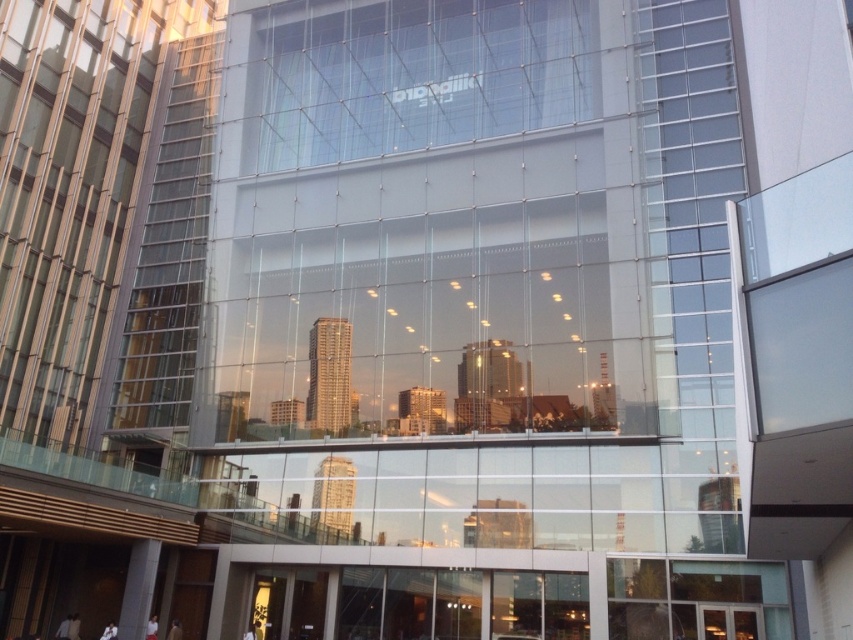
Is point (138, 141) less distant than point (296, 161)?

No.

Is transparent glass building at center wider than transparent glass window at center?

No.

This screenshot has width=853, height=640. What do you see at coordinates (79, 189) in the screenshot?
I see `transparent glass building at center` at bounding box center [79, 189].

The width and height of the screenshot is (853, 640). Identify the location of transparent glass building at center. (79, 189).